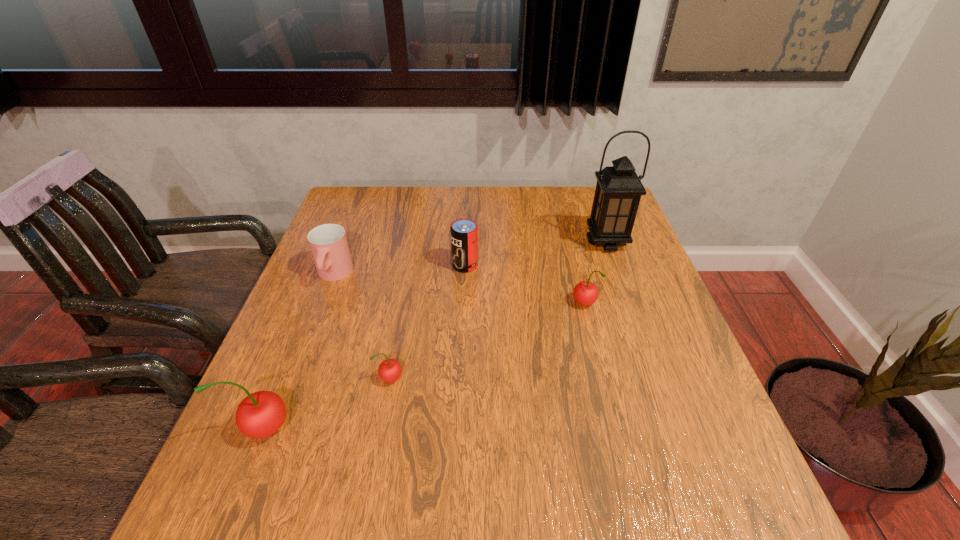
Locate an element on the screen. Image resolution: width=960 pixels, height=540 pixels. free space that satisfies the following two spatial constraints: 1. on the side of the cup with the handle; 2. on the right side of the rightmost cherry is located at coordinates (323, 305).

Where is `vacant space that satisfies the following two spatial constraints: 1. on the side of the rightmost cherry with the handle; 2. on the right side of the cup`? The image size is (960, 540). vacant space that satisfies the following two spatial constraints: 1. on the side of the rightmost cherry with the handle; 2. on the right side of the cup is located at coordinates (323, 305).